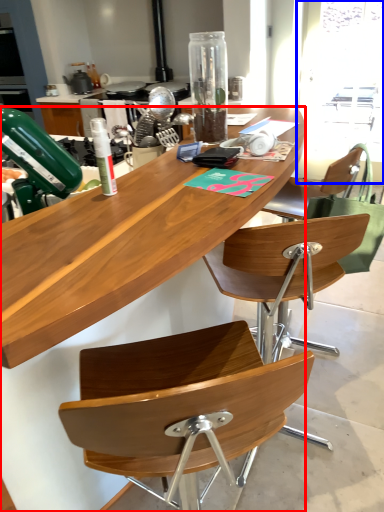
Question: Which point is closer to the camera, desk (highlighted by a red box) or window screen (highlighted by a blue box)?

Choices:
 (A) desk
 (B) window screen

Answer: (A)